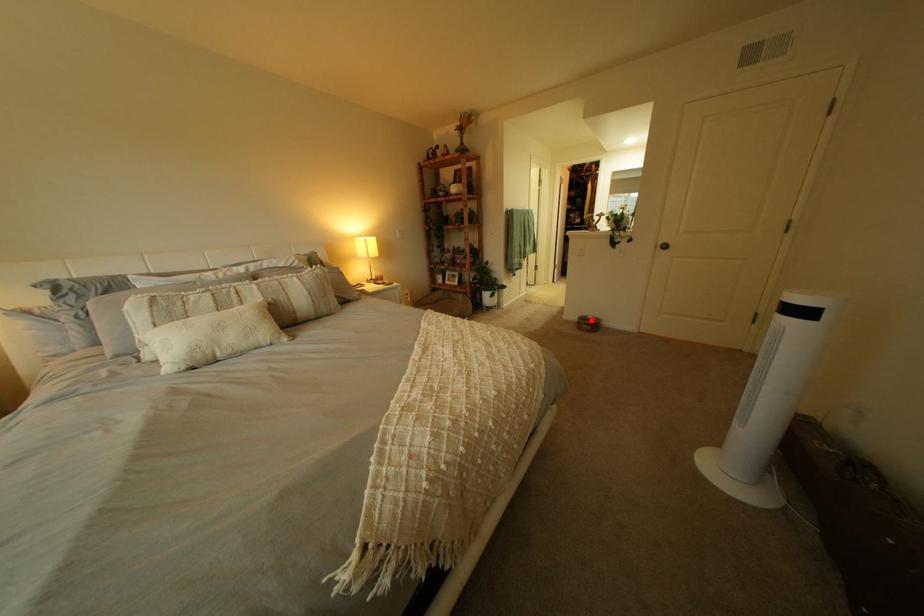
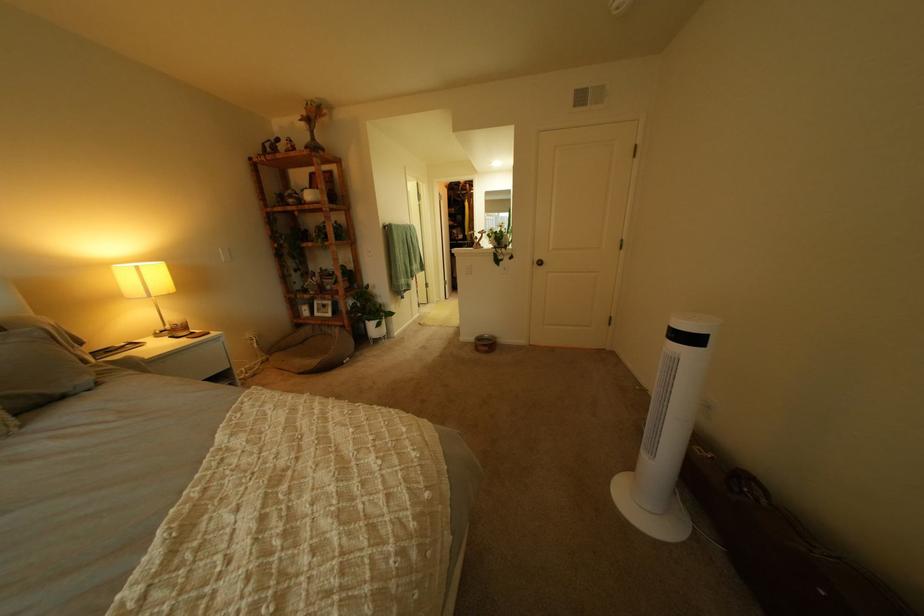
Question: I am providing you with two images of the same scene from different viewpoints. Image1 has a red point marked. In image2, the corresponding 3D location appears at what relative position? Reply with the corresponding letter.

Choices:
 (A) Closer
 (B) Farther

Answer: (B)